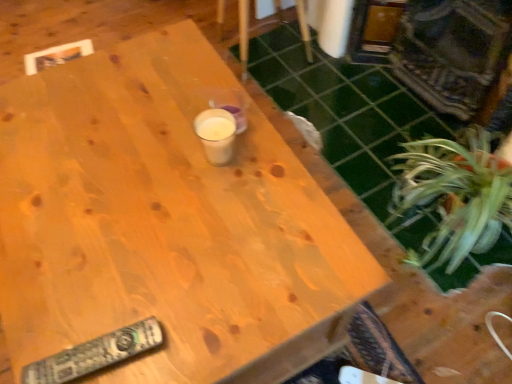
What are the coordinates of `vacant space to the right of black plastic remote at lower left` in the screenshot? It's located at (192, 324).